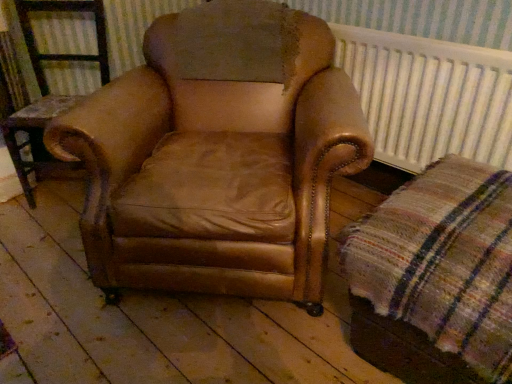
Question: Considering the positions of plaid fabric at lower right and brown leather armchair at center in the image, is plaid fabric at lower right taller or shorter than brown leather armchair at center?

Choices:
 (A) tall
 (B) short

Answer: (B)

Question: In terms of width, does plaid fabric at lower right look wider or thinner when compared to brown leather armchair at center?

Choices:
 (A) wide
 (B) thin

Answer: (A)

Question: Which of these objects is positioned closest to the plaid fabric at lower right?

Choices:
 (A) white textured radiator at upper right
 (B) brown leather armchair at center
 (C) brown leather armchair at center

Answer: (B)

Question: Estimate the real-world distances between objects in this image. Which object is closer to the plaid fabric at lower right?

Choices:
 (A) white textured radiator at upper right
 (B) brown leather armchair at center
 (C) brown leather armchair at center

Answer: (B)